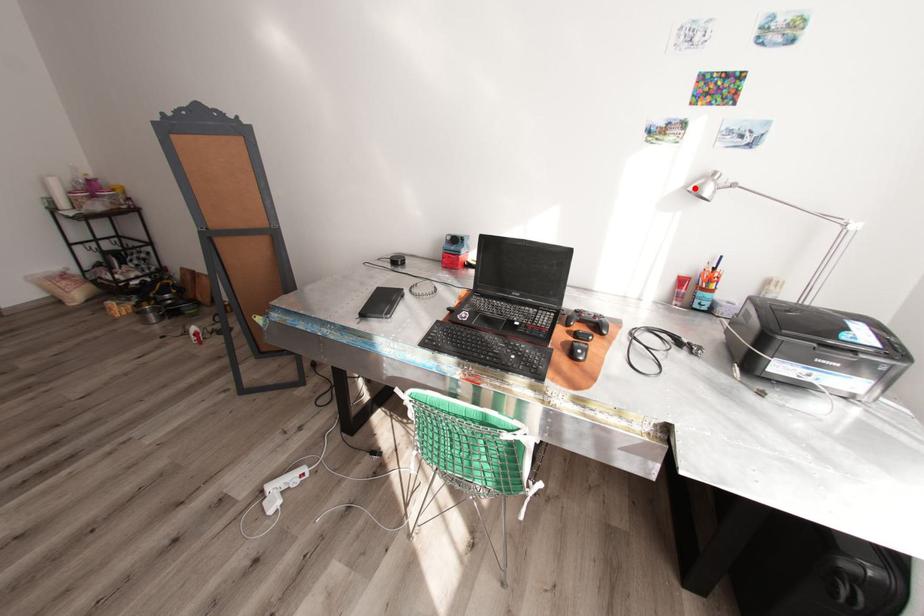
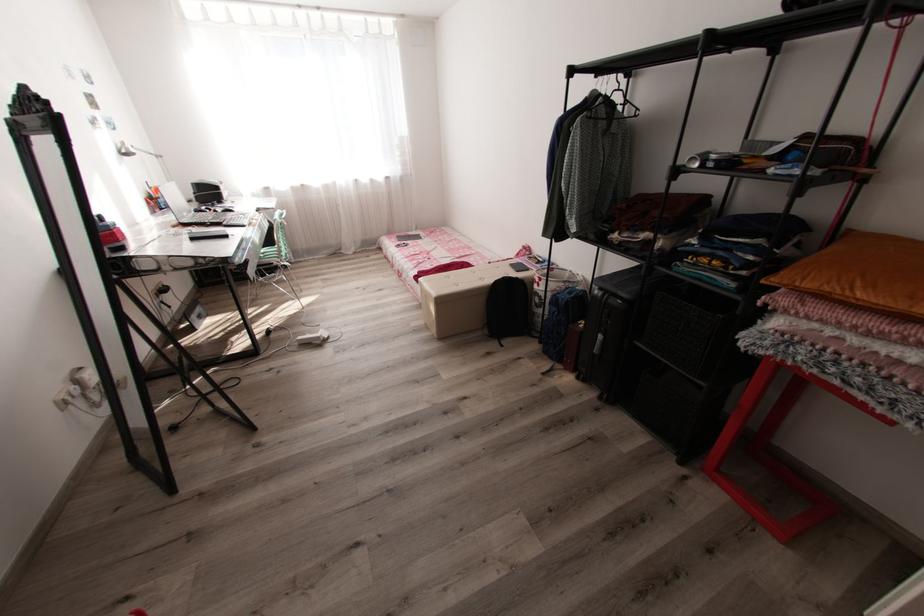
The point at the highlighted location is marked in the first image. Where is the corresponding point in the second image?

(129, 151)